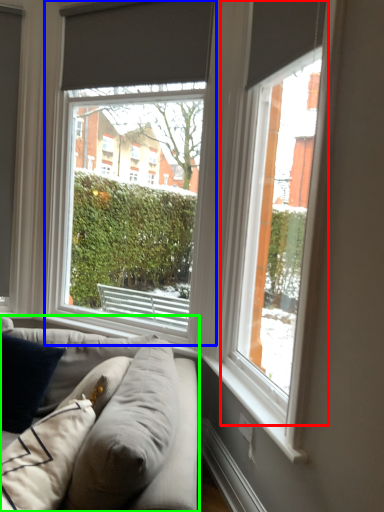
Question: Which object is positioned closest to window (highlighted by a red box)? Select from window (highlighted by a blue box) and studio couch (highlighted by a green box).

Choices:
 (A) window
 (B) studio couch

Answer: (B)